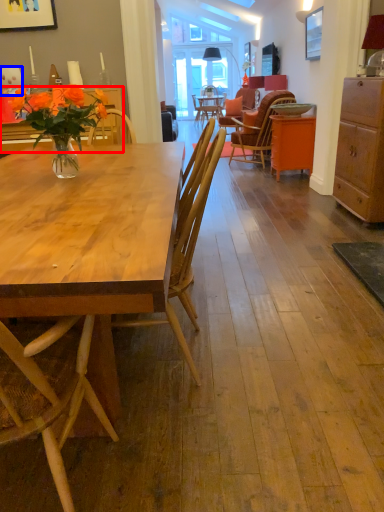
Question: Which point is further to the camera, desk (highlighted by a red box) or coffee cup (highlighted by a blue box)?

Choices:
 (A) desk
 (B) coffee cup

Answer: (B)